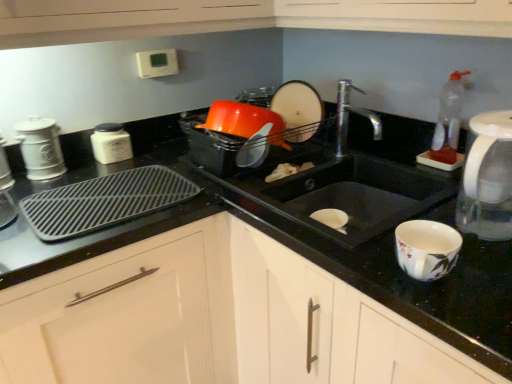
Question: Is white matte canister at left, which is the fifth appliance in right-to-left order, outside black plastic tray at left?

Choices:
 (A) yes
 (B) no

Answer: (A)

Question: From a real-world perspective, does white matte canister at left, which is the fifth appliance in right-to-left order, sit lower than black plastic tray at left?

Choices:
 (A) yes
 (B) no

Answer: (B)

Question: Does white matte canister at left, which appears as the 1th appliance when viewed from the left, appear on the left side of black plastic tray at left?

Choices:
 (A) yes
 (B) no

Answer: (A)

Question: From a real-world perspective, does white matte canister at left, which is the fifth appliance in right-to-left order, stand above black plastic tray at left?

Choices:
 (A) yes
 (B) no

Answer: (A)

Question: Is the position of white matte canister at left, which appears as the 1th appliance when viewed from the left, more distant than that of black plastic tray at left?

Choices:
 (A) no
 (B) yes

Answer: (B)

Question: Considering the relative sizes of white matte canister at left, which is the fifth appliance in right-to-left order, and black plastic tray at left in the image provided, is white matte canister at left, which is the fifth appliance in right-to-left order, taller than black plastic tray at left?

Choices:
 (A) no
 (B) yes

Answer: (B)

Question: Considering the relative sizes of black matte sink at center and white matte canister at left, which is the fifth appliance in right-to-left order, in the image provided, is black matte sink at center bigger than white matte canister at left, which is the fifth appliance in right-to-left order,?

Choices:
 (A) yes
 (B) no

Answer: (A)

Question: Considering the relative sizes of black matte sink at center and white matte canister at left, which appears as the 1th appliance when viewed from the left, in the image provided, is black matte sink at center smaller than white matte canister at left, which appears as the 1th appliance when viewed from the left,?

Choices:
 (A) yes
 (B) no

Answer: (B)

Question: Does black matte sink at center have a greater width compared to white matte canister at left, which is the fifth appliance in right-to-left order?

Choices:
 (A) no
 (B) yes

Answer: (B)

Question: Is the position of black matte sink at center less distant than that of white matte canister at left, which is the fifth appliance in right-to-left order?

Choices:
 (A) yes
 (B) no

Answer: (A)

Question: From a real-world perspective, is black matte sink at center below white matte canister at left, which appears as the 1th appliance when viewed from the left?

Choices:
 (A) yes
 (B) no

Answer: (A)

Question: Does black matte sink at center appear on the right side of white matte canister at left, which is the fifth appliance in right-to-left order?

Choices:
 (A) no
 (B) yes

Answer: (B)

Question: Is white matte jar at left, acting as the 3th appliance starting from the left, thinner than white ceramic canister at left, which appears as the fourth appliance when viewed from the right?

Choices:
 (A) yes
 (B) no

Answer: (B)